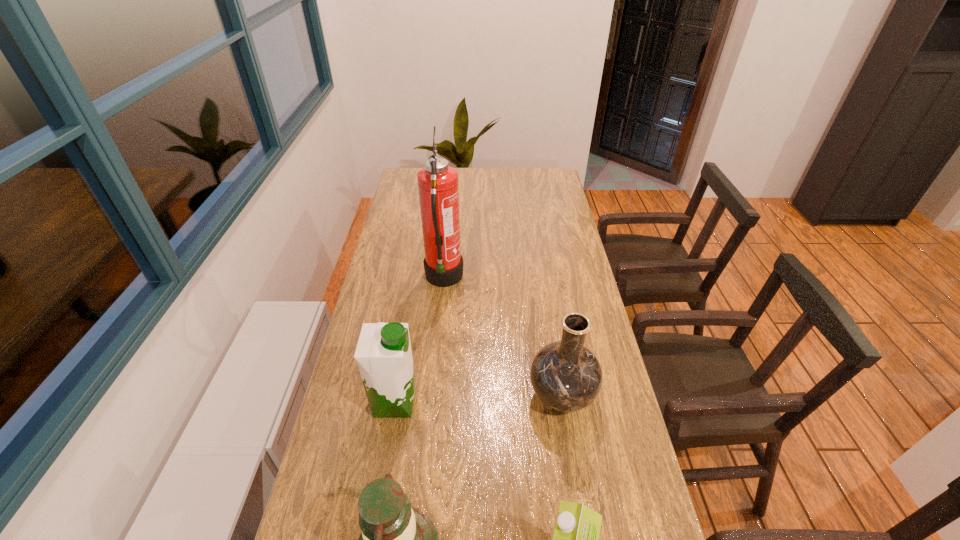
Where is `blank area in the image that satisfies the following two spatial constraints: 1. on the back side of the vase; 2. on the front-facing side of the fire extinguisher`? This screenshot has height=540, width=960. blank area in the image that satisfies the following two spatial constraints: 1. on the back side of the vase; 2. on the front-facing side of the fire extinguisher is located at coordinates (543, 279).

At what (x,y) coordinates should I click in order to perform the action: click on vacant area that satisfies the following two spatial constraints: 1. on the front-facing side of the fire extinguisher; 2. on the right side of the vase. Please return your answer as a coordinate pair (x, y). This screenshot has height=540, width=960. Looking at the image, I should click on (433, 396).